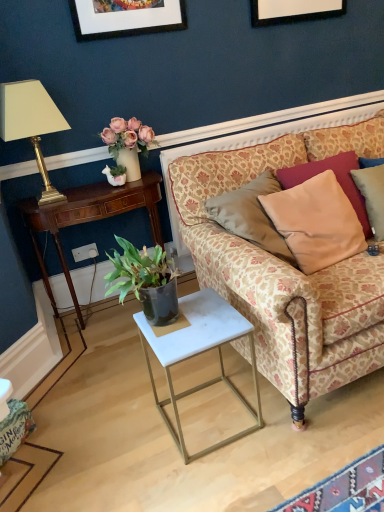
The width and height of the screenshot is (384, 512). In order to click on vacant space positioned to the left of white marble table at lower center in this screenshot , I will do `click(120, 433)`.